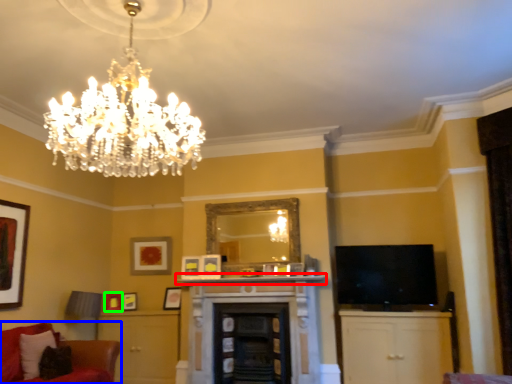
Question: Considering the real-world distances, which object is closest to mantle (highlighted by a red box)? studio couch (highlighted by a blue box) or picture frame (highlighted by a green box).

Choices:
 (A) studio couch
 (B) picture frame

Answer: (B)